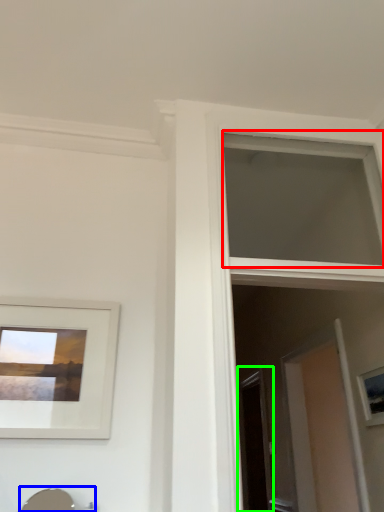
Question: Based on their relative distances, which object is nearer to window (highlighted by a red box)? Choose from sink (highlighted by a blue box) and screen door (highlighted by a green box).

Choices:
 (A) sink
 (B) screen door

Answer: (B)